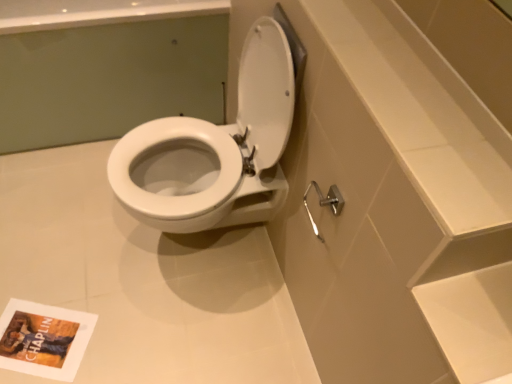
Find the location of a particular element. The image size is (512, 384). vacant space to the right of matte paper book cover at lower left is located at coordinates (114, 334).